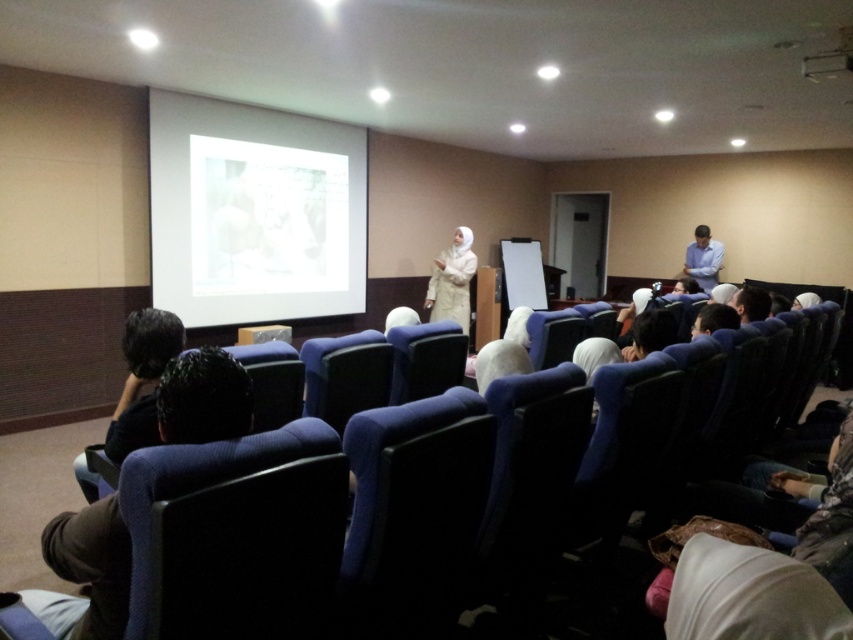
Question: Is dark hair at lower left further to camera compared to blue shirt at right?

Choices:
 (A) yes
 (B) no

Answer: (B)

Question: Based on their relative distances, which object is nearer to the dark brown fabric at lower left?

Choices:
 (A) blue shirt at right
 (B) white matte projection screen at upper center

Answer: (B)

Question: Can you confirm if white matte projection screen at upper center is positioned below dark brown fabric at lower left?

Choices:
 (A) no
 (B) yes

Answer: (A)

Question: Which point appears closest to the camera in this image?

Choices:
 (A) (440, 316)
 (B) (697, 269)
 (C) (204, 410)

Answer: (C)

Question: Does dark brown fabric at lower left come in front of white matte hijab at center?

Choices:
 (A) yes
 (B) no

Answer: (A)

Question: Among these objects, which one is farthest from the camera?

Choices:
 (A) dark brown fabric at lower left
 (B) dark hair at lower left
 (C) white matte projection screen at upper center

Answer: (C)